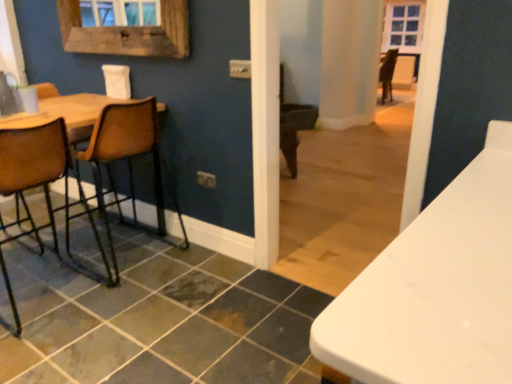
Image resolution: width=512 pixels, height=384 pixels. Identify the location of wooden frame at upper left. (127, 33).

At what (x,y) coordinates should I click in order to perform the action: click on slate tile at lower left. Please return your answer as a coordinate pair (x, y). Looking at the image, I should click on (158, 320).

Image resolution: width=512 pixels, height=384 pixels. I want to click on wooden frame at upper left, so click(127, 33).

In the image, there is a brown leather chair at left, which is counted as the 1th chair, starting from the right. Where is `window frame above it (from the image's perspective)`? The width and height of the screenshot is (512, 384). window frame above it (from the image's perspective) is located at coordinates (127, 33).

Would you say wooden frame at upper left is part of brown leather chair at left, which is counted as the 1th chair, starting from the right,'s contents?

That's incorrect, wooden frame at upper left is not inside brown leather chair at left, which is counted as the 1th chair, starting from the right.

Can you confirm if brown leather chair at left, which is counted as the 1th chair, starting from the right, is thinner than wooden frame at upper left?

No, brown leather chair at left, which is counted as the 1th chair, starting from the right, is not thinner than wooden frame at upper left.

From the image's perspective, does brown leather chair at left, which is counted as the 1th chair, starting from the right, appear lower than wooden frame at upper left?

Correct, brown leather chair at left, which is counted as the 1th chair, starting from the right, appears lower than wooden frame at upper left in the image.

Could you measure the distance between slate tile at lower left and wooden seat at left, marked as the 1th chair in a left-to-right arrangement?

They are 21.14 inches apart.

Is slate tile at lower left facing away from wooden seat at left, marked as the 1th chair in a left-to-right arrangement?

That's not correct — slate tile at lower left is not looking away from wooden seat at left, marked as the 1th chair in a left-to-right arrangement.

Is slate tile at lower left not close to wooden seat at left, which is counted as the 2th chair, starting from the right?

slate tile at lower left is near wooden seat at left, which is counted as the 2th chair, starting from the right, not far away.

Can you confirm if brown leather chair at left, which is the 2th chair from left to right, is smaller than slate tile at lower left?

Incorrect, brown leather chair at left, which is the 2th chair from left to right, is not smaller in size than slate tile at lower left.

Looking at this image, from a real-world perspective, is brown leather chair at left, which is the 2th chair from left to right, positioned over slate tile at lower left based on gravity?

Yes.

Which of these two, brown leather chair at left, which is the 2th chair from left to right, or slate tile at lower left, is wider?

slate tile at lower left is wider.

Which object is positioned more to the left, brown leather chair at left, which is counted as the 1th chair, starting from the right, or slate tile at lower left?

From the viewer's perspective, brown leather chair at left, which is counted as the 1th chair, starting from the right, appears more on the left side.

Locate an element on the screen. chair directly beneath the brown leather chair at left, which is counted as the 1th chair, starting from the right (from a real-world perspective) is located at coordinates coord(50,179).

Can wooden seat at left, which is counted as the 2th chair, starting from the right, be found inside brown leather chair at left, which is the 2th chair from left to right?

No.

Between brown leather chair at left, which is counted as the 1th chair, starting from the right, and wooden seat at left, marked as the 1th chair in a left-to-right arrangement, which one has larger size?

wooden seat at left, marked as the 1th chair in a left-to-right arrangement.

Can you confirm if brown leather chair at left, which is counted as the 1th chair, starting from the right, is positioned to the left of wooden seat at left, marked as the 1th chair in a left-to-right arrangement?

Incorrect, brown leather chair at left, which is counted as the 1th chair, starting from the right, is not on the left side of wooden seat at left, marked as the 1th chair in a left-to-right arrangement.

Considering the relative sizes of wooden seat at left, which is counted as the 2th chair, starting from the right, and slate tile at lower left in the image provided, is wooden seat at left, which is counted as the 2th chair, starting from the right, smaller than slate tile at lower left?

No.

Is the position of wooden seat at left, marked as the 1th chair in a left-to-right arrangement, more distant than that of slate tile at lower left?

Yes, wooden seat at left, marked as the 1th chair in a left-to-right arrangement, is further from the viewer.

Which is correct: wooden seat at left, marked as the 1th chair in a left-to-right arrangement, is inside slate tile at lower left, or outside of it?

The correct answer is: outside.

Does wooden frame at upper left have a greater width compared to wooden seat at left, marked as the 1th chair in a left-to-right arrangement?

No.

Which point is more forward, (113, 51) or (42, 143)?

Positioned in front is point (42, 143).

Considering the relative sizes of wooden frame at upper left and wooden seat at left, marked as the 1th chair in a left-to-right arrangement, in the image provided, is wooden frame at upper left bigger than wooden seat at left, marked as the 1th chair in a left-to-right arrangement,?

No.

Does wooden frame at upper left lie behind wooden seat at left, which is counted as the 2th chair, starting from the right?

That is True.

How much distance is there between wooden frame at upper left and slate tile at lower left?

A distance of 1.44 meters exists between wooden frame at upper left and slate tile at lower left.

From the image's perspective, is wooden frame at upper left over slate tile at lower left?

Yes.

Which is behind, wooden frame at upper left or slate tile at lower left?

Positioned behind is wooden frame at upper left.

Is wooden frame at upper left looking in the opposite direction of slate tile at lower left?

No, slate tile at lower left is not at the back of wooden frame at upper left.

The image size is (512, 384). Find the location of `chair lying on the right of wooden frame at upper left`. chair lying on the right of wooden frame at upper left is located at coordinates (123, 159).

The image size is (512, 384). I want to click on tile that is below the wooden seat at left, marked as the 1th chair in a left-to-right arrangement (from the image's perspective), so click(x=158, y=320).

When comparing their distances from wooden seat at left, which is counted as the 2th chair, starting from the right, does brown leather chair at left, which is the 2th chair from left to right, or wooden frame at upper left seem further?

wooden frame at upper left is further to wooden seat at left, which is counted as the 2th chair, starting from the right.

Based on their spatial positions, is wooden frame at upper left or wooden seat at left, marked as the 1th chair in a left-to-right arrangement, further from brown leather chair at left, which is counted as the 1th chair, starting from the right?

wooden seat at left, marked as the 1th chair in a left-to-right arrangement, lies further to brown leather chair at left, which is counted as the 1th chair, starting from the right, than the other object.

Estimate the real-world distances between objects in this image. Which object is further from slate tile at lower left, wooden seat at left, which is counted as the 2th chair, starting from the right, or brown leather chair at left, which is counted as the 1th chair, starting from the right?

brown leather chair at left, which is counted as the 1th chair, starting from the right, lies further to slate tile at lower left than the other object.

Based on their spatial positions, is brown leather chair at left, which is the 2th chair from left to right, or wooden seat at left, which is counted as the 2th chair, starting from the right, closer to slate tile at lower left?

wooden seat at left, which is counted as the 2th chair, starting from the right, lies closer to slate tile at lower left than the other object.

Which object lies further to the anchor point brown leather chair at left, which is counted as the 1th chair, starting from the right, wooden seat at left, which is counted as the 2th chair, starting from the right, or slate tile at lower left?

slate tile at lower left lies further to brown leather chair at left, which is counted as the 1th chair, starting from the right, than the other object.

Considering their positions, is brown leather chair at left, which is counted as the 1th chair, starting from the right, positioned closer to wooden frame at upper left than wooden seat at left, which is counted as the 2th chair, starting from the right?

The object closer to wooden frame at upper left is brown leather chair at left, which is counted as the 1th chair, starting from the right.

Looking at the image, which one is located closer to brown leather chair at left, which is counted as the 1th chair, starting from the right, wooden frame at upper left or slate tile at lower left?

Among the two, wooden frame at upper left is located nearer to brown leather chair at left, which is counted as the 1th chair, starting from the right.

From the image, which object appears to be farther from wooden seat at left, marked as the 1th chair in a left-to-right arrangement, slate tile at lower left or wooden frame at upper left?

wooden frame at upper left is further to wooden seat at left, marked as the 1th chair in a left-to-right arrangement.

You are a GUI agent. You are given a task and a screenshot of the screen. Output one action in this format:
    pyautogui.click(x=<x>, y=<y>)
    Task: Click on the chair between wooden frame at upper left and wooden seat at left, marked as the 1th chair in a left-to-right arrangement, vertically
    The width and height of the screenshot is (512, 384).
    Given the screenshot: What is the action you would take?
    pyautogui.click(x=123, y=159)

Identify the location of chair between slate tile at lower left and brown leather chair at left, which is counted as the 1th chair, starting from the right, along the z-axis. Image resolution: width=512 pixels, height=384 pixels. (50, 179).